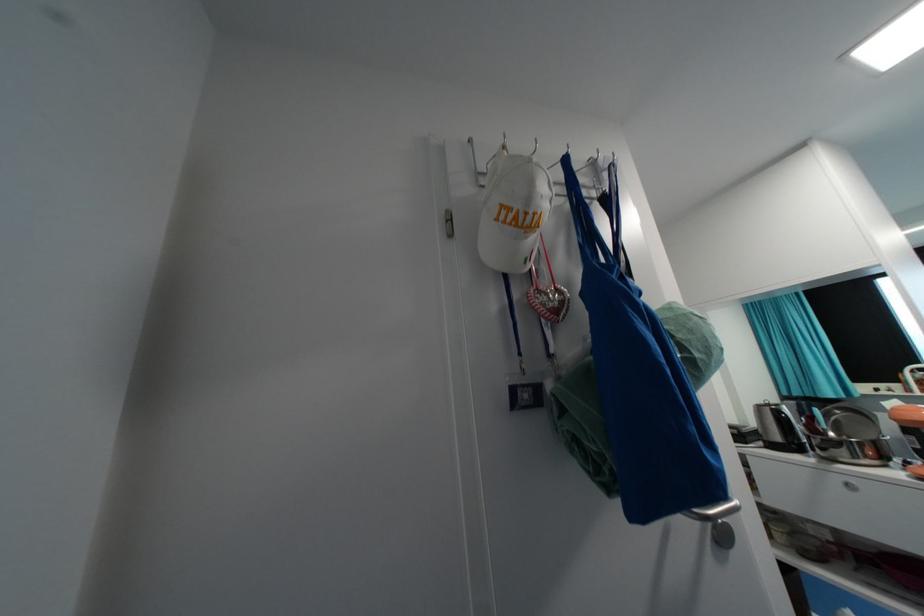
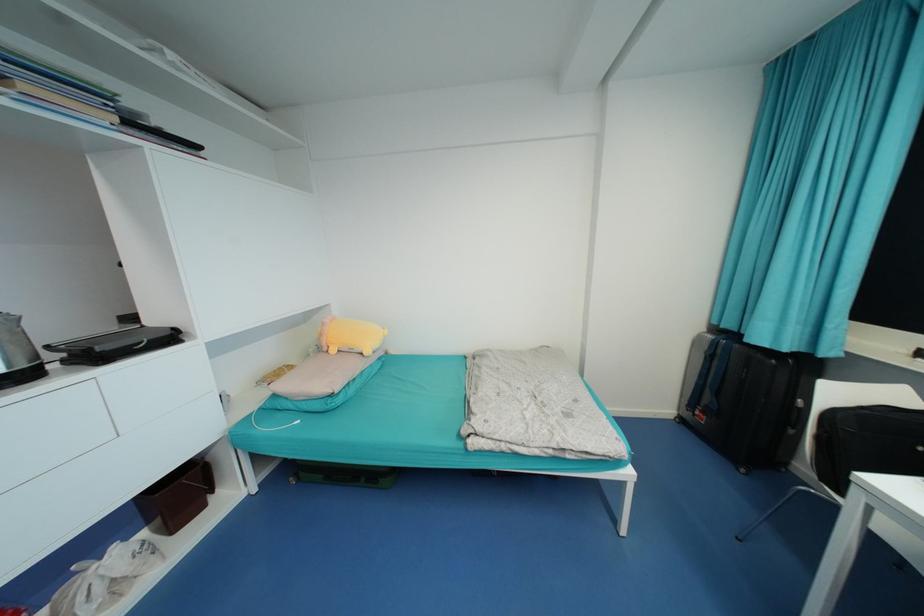
Locate, in the second image, the point that corresponds to the point at 804,406 in the first image.

(719, 345)